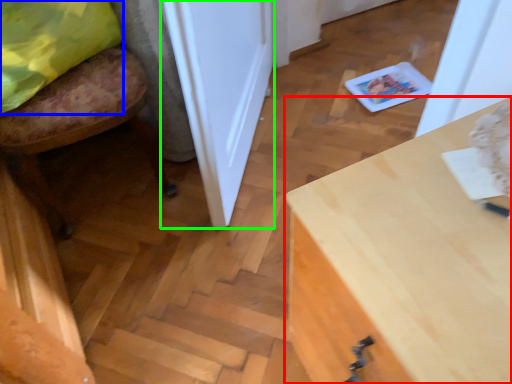
Question: Considering the real-world distances, which object is farthest from desk (highlighted by a red box)? pillow (highlighted by a blue box) or door (highlighted by a green box)?

Choices:
 (A) pillow
 (B) door

Answer: (A)